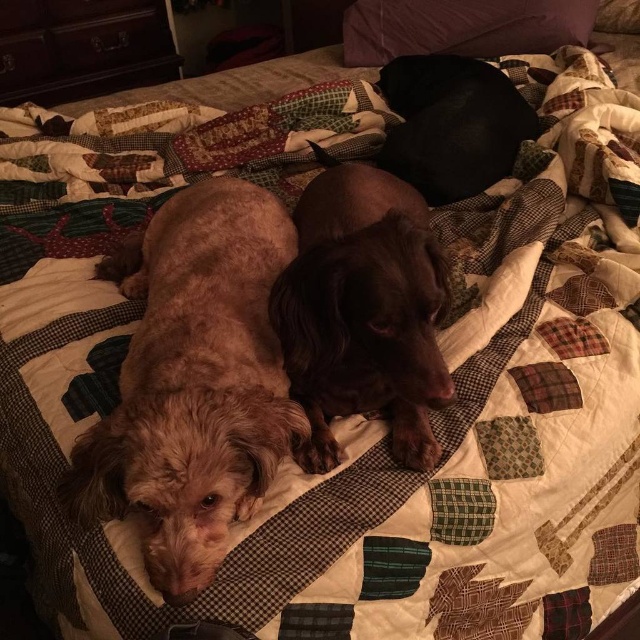
Question: Which object is farther from the camera taking this photo?

Choices:
 (A) shiny brown dog at center
 (B) black smooth dog at upper center

Answer: (B)

Question: Does dark wood dresser at upper left appear on the left side of purple fabric pillow at upper center?

Choices:
 (A) yes
 (B) no

Answer: (A)

Question: Does fuzzy brown dog at center have a lesser width compared to purple fabric pillow at upper center?

Choices:
 (A) yes
 (B) no

Answer: (A)

Question: Does shiny brown dog at center have a larger size compared to purple fabric pillow at upper center?

Choices:
 (A) yes
 (B) no

Answer: (A)

Question: Considering the real-world distances, which object is farthest from the purple fabric pillow at upper center?

Choices:
 (A) fuzzy brown dog at center
 (B) black smooth dog at upper center
 (C) dark wood dresser at upper left
 (D) shiny brown dog at center

Answer: (A)

Question: Which object appears farthest from the camera in this image?

Choices:
 (A) black smooth dog at upper center
 (B) purple fabric pillow at upper center
 (C) dark wood dresser at upper left

Answer: (C)